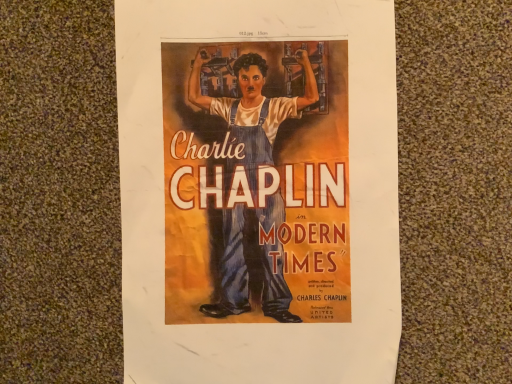
What are the coordinates of `blank space situated above matte blue overalls at center (from a real-world perspective)` in the screenshot? It's located at (258, 202).